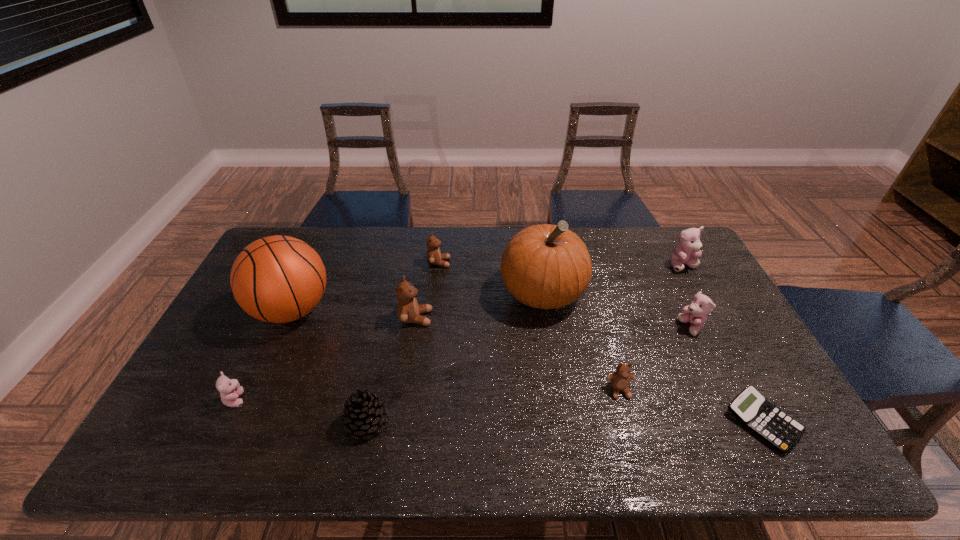
Locate an element on the screen. This screenshot has height=540, width=960. object situated at the far right corner is located at coordinates (689, 246).

Locate an element on the screen. Image resolution: width=960 pixels, height=540 pixels. object present at the near right corner is located at coordinates (751, 408).

Find the location of a particular element. Image resolution: width=960 pixels, height=540 pixels. vacant space at the far edge of the desktop is located at coordinates (473, 246).

The image size is (960, 540). In order to click on vacant space at the near edge of the desktop in this screenshot , I will do `click(579, 461)`.

In the image, there is a desktop. Identify the location of free space at the left edge. [234, 348].

Locate an element on the screen. Image resolution: width=960 pixels, height=540 pixels. free space at the right edge of the desktop is located at coordinates (709, 288).

I want to click on free space at the far right corner of the desktop, so click(x=657, y=260).

At what (x,y) coordinates should I click in order to perform the action: click on vacant space that is in between the second nearest brown teddy bear and the farthest brown teddy bear. Please return your answer as a coordinate pair (x, y). Looking at the image, I should click on (427, 291).

Image resolution: width=960 pixels, height=540 pixels. Find the location of `empty location between the biggest pink teddy bear and the pinecone`. empty location between the biggest pink teddy bear and the pinecone is located at coordinates (525, 344).

You are a GUI agent. You are given a task and a screenshot of the screen. Output one action in this format:
    pyautogui.click(x=<x>, y=<y>)
    Task: Click on the blank region between the basketball and the nearest brown teddy bear
    
    Given the screenshot: What is the action you would take?
    pyautogui.click(x=456, y=350)